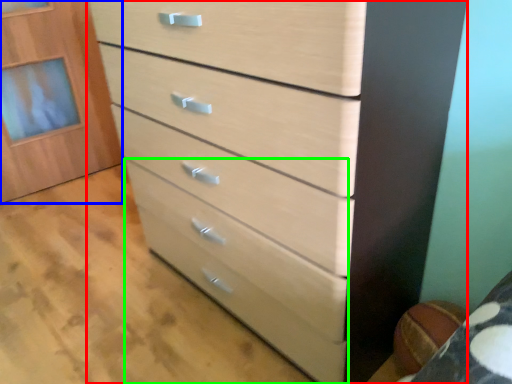
Question: Considering the real-world distances, which object is farthest from chest of drawers (highlighted by a red box)? cabinetry (highlighted by a blue box) or drawer (highlighted by a green box)?

Choices:
 (A) cabinetry
 (B) drawer

Answer: (A)